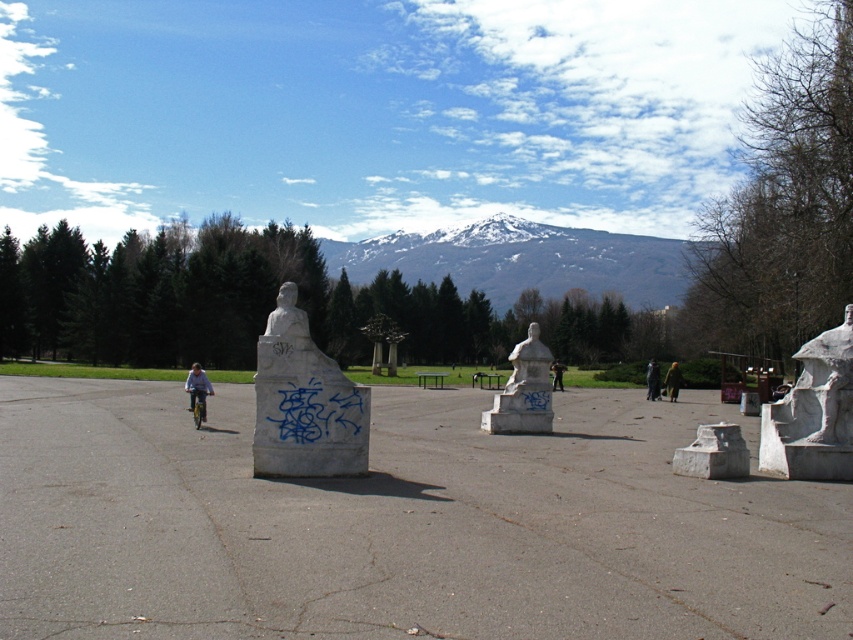
Looking at this image, who is positioned more to the left, white marble statue at center or light blue fabric jacket at left?

light blue fabric jacket at left is more to the left.

Does point (548, 372) lie in front of point (201, 394)?

Yes, point (548, 372) is in front of point (201, 394).

Locate an element on the screen. The width and height of the screenshot is (853, 640). white marble statue at center is located at coordinates (523, 390).

Which is more to the right, white marble statue at center or dark blue jacket at center?

Positioned to the right is dark blue jacket at center.

Between point (512, 396) and point (653, 371), which one is positioned in front?

Point (512, 396)

Between point (525, 404) and point (648, 365), which one is positioned in front?

Positioned in front is point (525, 404).

At what (x,y) coordinates should I click in order to perform the action: click on white marble statue at center. Please return your answer as a coordinate pair (x, y). This screenshot has width=853, height=640. Looking at the image, I should click on click(523, 390).

Is white stone bust at center taller than dark blue jacket at center?

Incorrect, white stone bust at center's height is not larger of dark blue jacket at center's.

Is point (339, 428) behind point (653, 372)?

No, (339, 428) is closer to viewer.

The height and width of the screenshot is (640, 853). What are the coordinates of `white stone bust at center` in the screenshot? It's located at (305, 403).